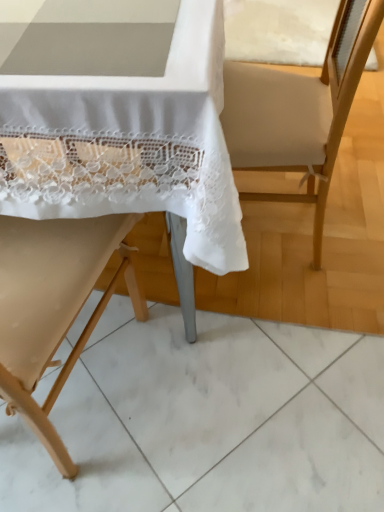
Where is `beige fabric chair at left, which is counted as the 1th chair, starting from the bottom`? beige fabric chair at left, which is counted as the 1th chair, starting from the bottom is located at coordinates (53, 306).

Image resolution: width=384 pixels, height=512 pixels. I want to click on beige fabric armchair at center, so click(299, 111).

The height and width of the screenshot is (512, 384). Identify the location of beige fabric chair at left, which is counted as the 1th chair, starting from the bottom. (53, 306).

Considering the sizes of objects beige fabric armchair at center and beige fabric chair at left, the second chair in the top-to-bottom sequence, in the image provided, who is bigger, beige fabric armchair at center or beige fabric chair at left, the second chair in the top-to-bottom sequence,?

beige fabric chair at left, the second chair in the top-to-bottom sequence, is bigger.

Which object is further away from the camera taking this photo, beige fabric armchair at center or beige fabric chair at left, the second chair in the top-to-bottom sequence?

beige fabric armchair at center is further from the camera.

How different are the orientations of beige fabric armchair at center and beige fabric chair at left, which is counted as the 1th chair, starting from the bottom, in degrees?

95.5 degrees.

Are beige fabric armchair at center and beige fabric chair at left, the second chair in the top-to-bottom sequence, far apart?

beige fabric armchair at center is near beige fabric chair at left, the second chair in the top-to-bottom sequence, not far away.

Is beige fabric chair at left, the second chair in the top-to-bottom sequence, positioned with its back to beige fabric armchair at center?

No.

Which is more to the left, beige fabric chair at left, which is counted as the 1th chair, starting from the bottom, or beige fabric armchair at center?

beige fabric chair at left, which is counted as the 1th chair, starting from the bottom.

Between beige fabric chair at left, which is counted as the 1th chair, starting from the bottom, and beige fabric armchair at center, which one is positioned in front?

beige fabric chair at left, which is counted as the 1th chair, starting from the bottom, is more forward.

From a real-world perspective, between beige fabric chair at left, which is counted as the 1th chair, starting from the bottom, and beige fabric armchair at center, who is vertically lower?

beige fabric armchair at center, from a real-world perspective.

From their relative heights in the image, would you say beige wood chair at center, which appears as the 1th chair when viewed from the top, is taller or shorter than beige fabric armchair at center?

Clearly, beige wood chair at center, which appears as the 1th chair when viewed from the top, is taller compared to beige fabric armchair at center.

Between beige wood chair at center, which appears as the 1th chair when viewed from the top, and beige fabric armchair at center, which one appears on the left side from the viewer's perspective?

beige wood chair at center, which appears as the 1th chair when viewed from the top, is more to the left.

How many degrees apart are the facing directions of beige wood chair at center, positioned as the second chair in bottom-to-top order, and beige fabric armchair at center?

The angular difference between beige wood chair at center, positioned as the second chair in bottom-to-top order, and beige fabric armchair at center is 176 degrees.

Is beige wood chair at center, which appears as the 1th chair when viewed from the top, with beige fabric chair at left, the second chair in the top-to-bottom sequence?

No, beige wood chair at center, which appears as the 1th chair when viewed from the top, is not making contact with beige fabric chair at left, the second chair in the top-to-bottom sequence.

Considering the sizes of objects beige wood chair at center, positioned as the second chair in bottom-to-top order, and beige fabric chair at left, which is counted as the 1th chair, starting from the bottom, in the image provided, who is taller, beige wood chair at center, positioned as the second chair in bottom-to-top order, or beige fabric chair at left, which is counted as the 1th chair, starting from the bottom,?

Standing taller between the two is beige fabric chair at left, which is counted as the 1th chair, starting from the bottom.

In terms of width, does beige wood chair at center, which appears as the 1th chair when viewed from the top, look wider or thinner when compared to beige fabric chair at left, the second chair in the top-to-bottom sequence?

beige wood chair at center, which appears as the 1th chair when viewed from the top, is wider than beige fabric chair at left, the second chair in the top-to-bottom sequence.

In order to click on the 1st chair counting from the left side of the beige fabric armchair at center in this screenshot , I will do `click(323, 239)`.

Considering the points (327, 178) and (276, 254), which point is behind, point (327, 178) or point (276, 254)?

The point (276, 254) is behind.

In terms of height, does beige fabric armchair at center look taller or shorter compared to beige wood chair at center, which appears as the 1th chair when viewed from the top?

In the image, beige fabric armchair at center appears to be shorter than beige wood chair at center, which appears as the 1th chair when viewed from the top.

From the image's perspective, is beige fabric chair at left, which is counted as the 1th chair, starting from the bottom, above beige wood chair at center, which appears as the 1th chair when viewed from the top?

No.

Looking at this image, is beige fabric chair at left, the second chair in the top-to-bottom sequence, outside of beige wood chair at center, which appears as the 1th chair when viewed from the top?

That's incorrect, beige fabric chair at left, the second chair in the top-to-bottom sequence, is not completely outside beige wood chair at center, which appears as the 1th chair when viewed from the top.

This screenshot has width=384, height=512. What are the coordinates of `chair on the left side of beige wood chair at center, positioned as the second chair in bottom-to-top order` in the screenshot? It's located at (53, 306).

Which chair is the 2nd one when counting from the front of the beige fabric armchair at center? Please provide its 2D coordinates.

[(53, 306)]

Which chair is the 2nd one when counting from the left side of the beige fabric armchair at center? Please provide its 2D coordinates.

[(53, 306)]

From the image, which object appears to be farther from beige fabric chair at left, the second chair in the top-to-bottom sequence, beige wood chair at center, which appears as the 1th chair when viewed from the top, or beige fabric armchair at center?

Based on the image, beige fabric armchair at center appears to be further to beige fabric chair at left, the second chair in the top-to-bottom sequence.

Considering their positions, is beige fabric chair at left, which is counted as the 1th chair, starting from the bottom, positioned closer to beige wood chair at center, positioned as the second chair in bottom-to-top order, than beige fabric armchair at center?

beige fabric chair at left, which is counted as the 1th chair, starting from the bottom, is positioned closer to the anchor beige wood chair at center, positioned as the second chair in bottom-to-top order.

Which object lies nearer to the anchor point beige wood chair at center, which appears as the 1th chair when viewed from the top, beige fabric armchair at center or beige fabric chair at left, which is counted as the 1th chair, starting from the bottom?

beige fabric chair at left, which is counted as the 1th chair, starting from the bottom, is positioned closer to the anchor beige wood chair at center, which appears as the 1th chair when viewed from the top.

Looking at the image, which one is located closer to beige fabric chair at left, which is counted as the 1th chair, starting from the bottom, beige fabric armchair at center or beige wood chair at center, which appears as the 1th chair when viewed from the top?

beige wood chair at center, which appears as the 1th chair when viewed from the top, is closer to beige fabric chair at left, which is counted as the 1th chair, starting from the bottom.

Looking at the image, which one is located further to beige fabric armchair at center, beige wood chair at center, positioned as the second chair in bottom-to-top order, or beige fabric chair at left, the second chair in the top-to-bottom sequence?

The object further to beige fabric armchair at center is beige fabric chair at left, the second chair in the top-to-bottom sequence.

Based on their spatial positions, is beige fabric chair at left, the second chair in the top-to-bottom sequence, or beige wood chair at center, positioned as the second chair in bottom-to-top order, closer to beige fabric armchair at center?

beige wood chair at center, positioned as the second chair in bottom-to-top order.

Find the location of a particular element. chair between beige fabric chair at left, which is counted as the 1th chair, starting from the bottom, and beige fabric armchair at center is located at coordinates (323, 239).